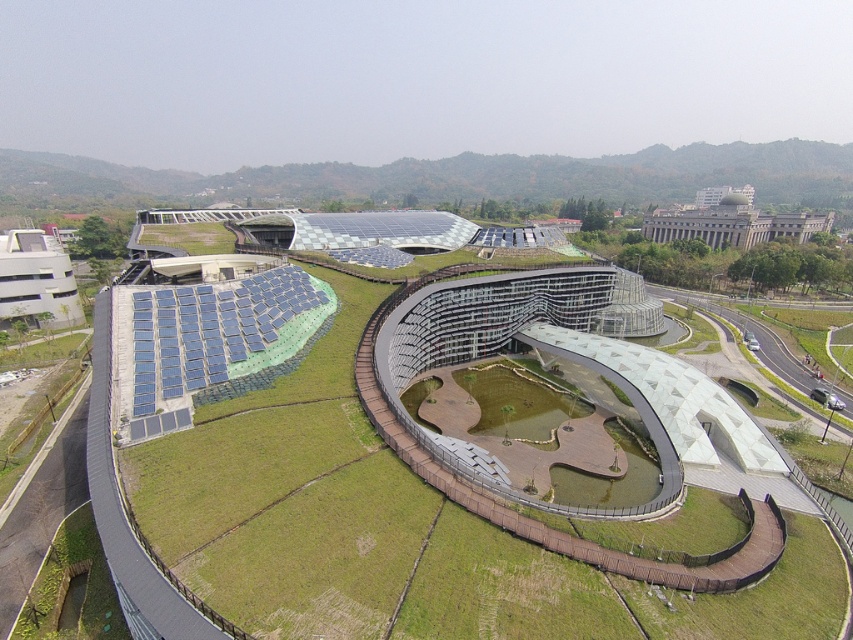
Question: Which object appears farthest from the camera in this image?

Choices:
 (A) gray concrete building at upper right
 (B) green grassy hillside at upper center
 (C) white concrete parking garage at upper left

Answer: (B)

Question: Can you confirm if green grass at center is bigger than white concrete parking garage at upper left?

Choices:
 (A) no
 (B) yes

Answer: (B)

Question: Which point is farther from the camera taking this photo?

Choices:
 (A) (308, 400)
 (B) (28, 234)

Answer: (B)

Question: Can you confirm if green grassy hillside at upper center is thinner than white concrete parking garage at upper left?

Choices:
 (A) yes
 (B) no

Answer: (B)

Question: Can you confirm if white concrete parking garage at upper left is positioned above gray concrete building at upper right?

Choices:
 (A) yes
 (B) no

Answer: (B)

Question: Which point is farther to the camera?

Choices:
 (A) green grass at center
 (B) green grassy hillside at upper center
 (C) white concrete parking garage at upper left

Answer: (B)